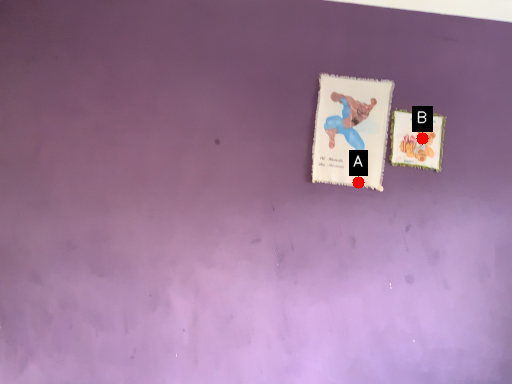
Question: Two points are circled on the image, labeled by A and B beside each circle. Which point is farther from the camera taking this photo?

Choices:
 (A) A is further
 (B) B is further

Answer: (B)